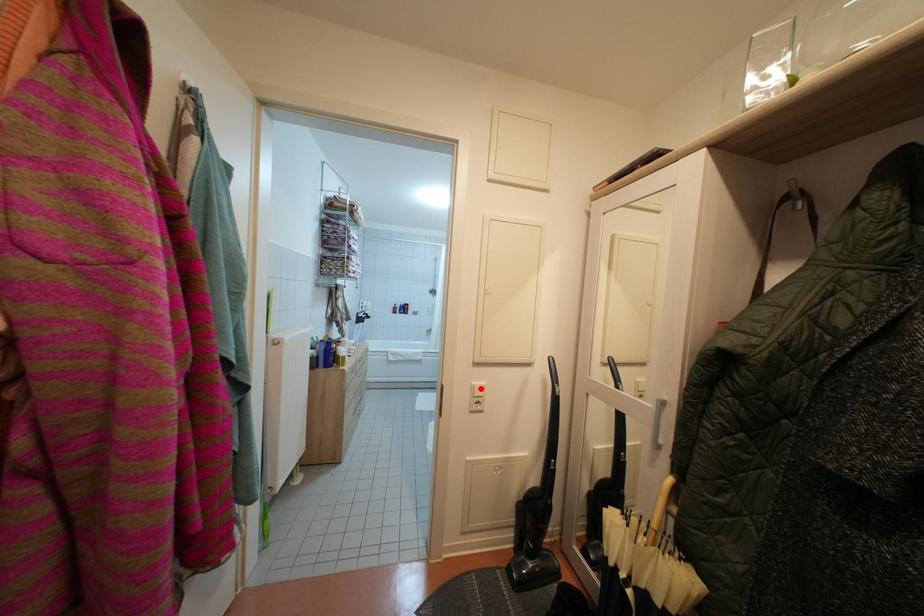
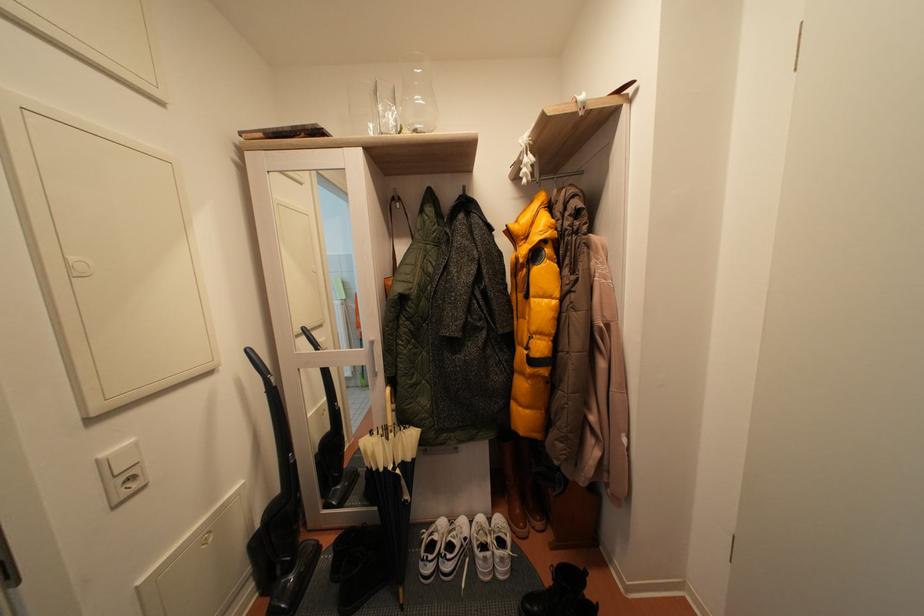
Locate, in the second image, the point that corresponds to the highlighted location in the first image.

(111, 460)